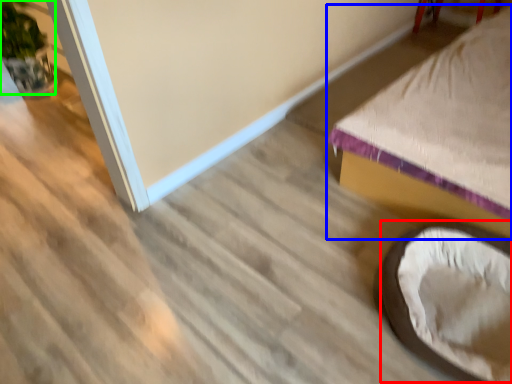
Question: Which object is the closest to the bean bag chair (highlighted by a red box)? Choose among these: furniture (highlighted by a blue box) or plant (highlighted by a green box).

Choices:
 (A) furniture
 (B) plant

Answer: (A)